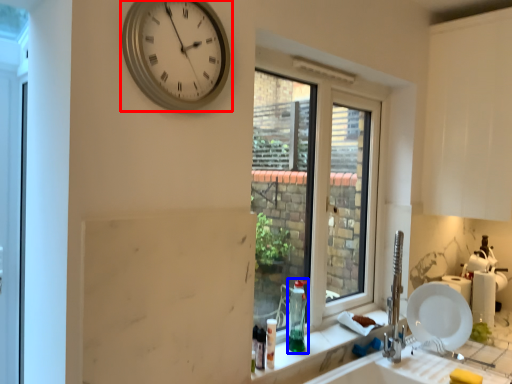
Question: Among these objects, which one is farthest to the camera, wall clock (highlighted by a red box) or bottle (highlighted by a blue box)?

Choices:
 (A) wall clock
 (B) bottle

Answer: (B)